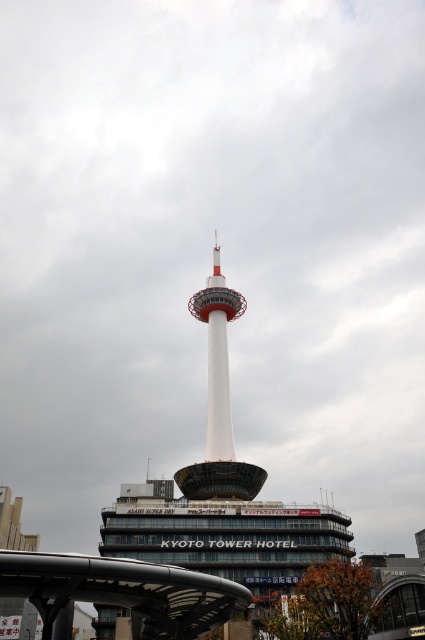
Does white smooth tower at center have a larger size compared to white glossy tower at center?

Yes.

Is point (309, 516) positioned in front of point (229, 417)?

Yes.

Does point (204, 509) lie in front of point (217, 320)?

Yes.

Where is `white smooth tower at center`? The height and width of the screenshot is (640, 425). white smooth tower at center is located at coordinates (221, 492).